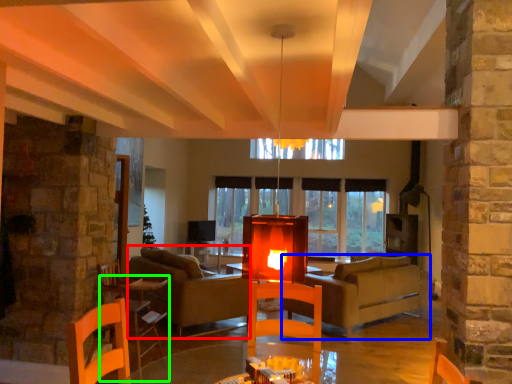
Question: Estimate the real-world distances between objects in this image. Which object is closer to couch (highlighted by a red box), studio couch (highlighted by a blue box) or table (highlighted by a green box)?

Choices:
 (A) studio couch
 (B) table

Answer: (B)